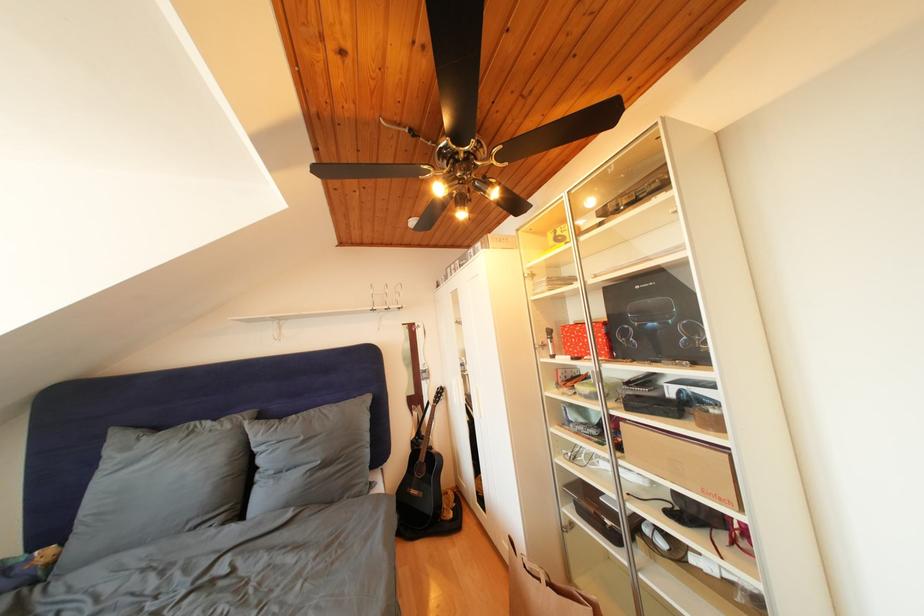
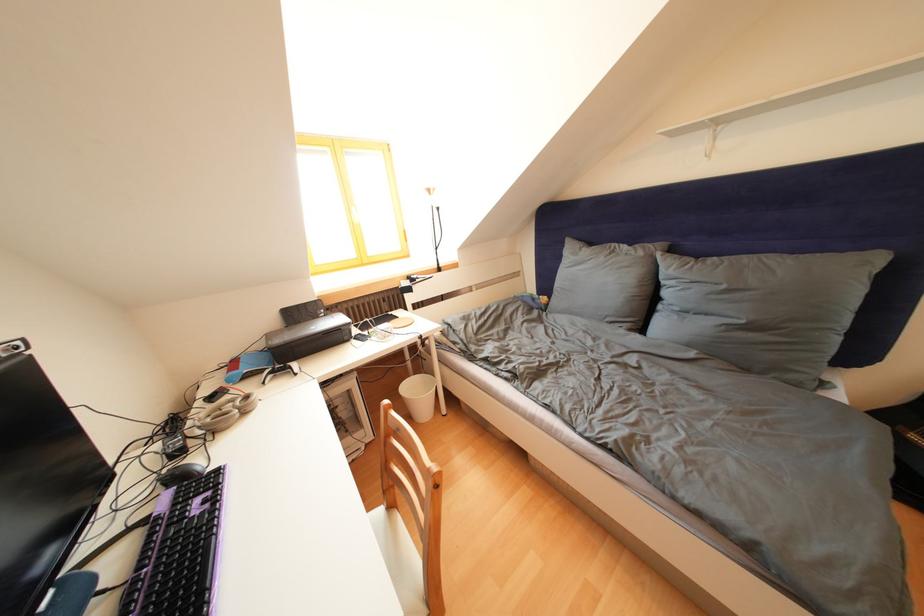
Locate, in the second image, the point that corresponds to pixel 236 432 in the first image.

(649, 259)